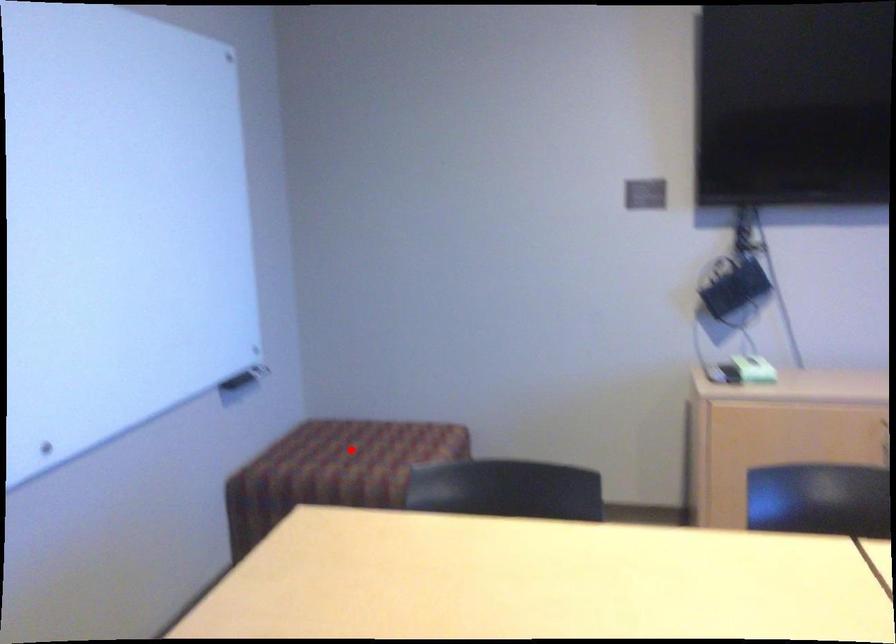
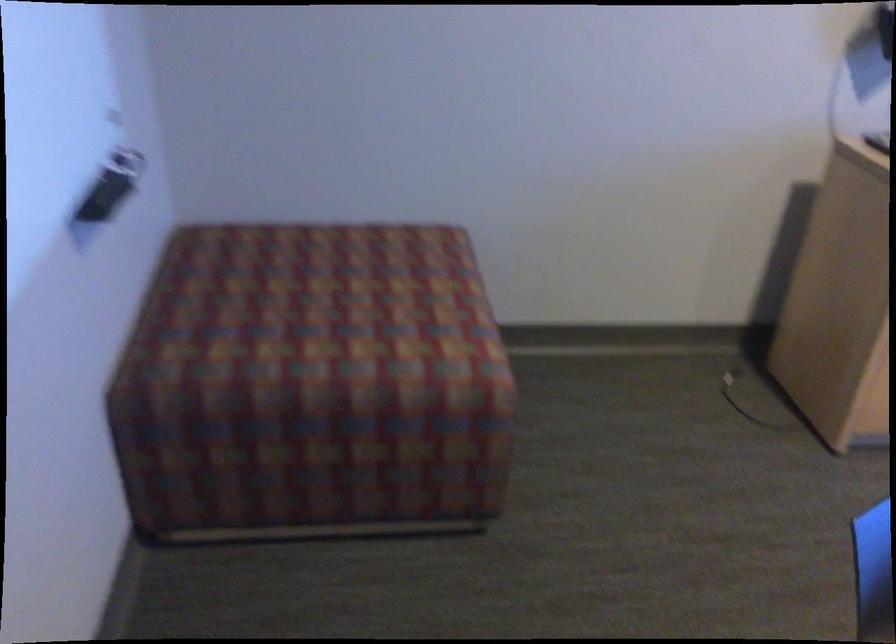
The point at the highlighted location is marked in the first image. Where is the corresponding point in the second image?

(332, 301)